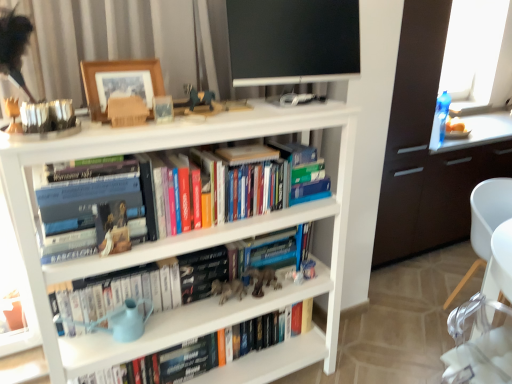
The width and height of the screenshot is (512, 384). Identify the location of free point in front of black glossy flat-screen tv at upper center. (277, 112).